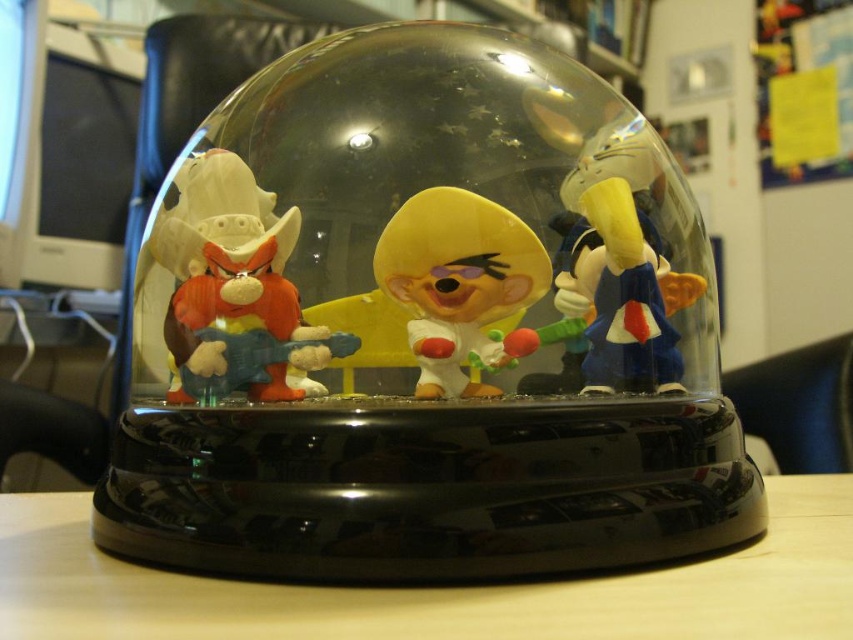
You are holding the glass dome and want to touch the wooden at center and the yellow matte figurine at center. Which one can you reach first without moving your hand?

The wooden at center is closer to the viewer than the yellow matte figurine at center, so you can reach the wooden at center first.

You are a collector who wants to display the two center figurines from the glass dome. Which one is taller, the matte plastic toy at center or the yellow matte figurine at center?

The matte plastic toy at center is taller than the yellow matte figurine at center.

Looking at this image, you are a collector who wants to display the two central figurines from the glass dome. The display shelf has a height limit of 10 cm. Can you place both the matte plastic toy at center and the yellow matte figurine at center on the shelf without exceeding the height limit?

The matte plastic toy at center is bigger than the yellow matte figurine at center, but the exact heights are not provided. Without knowing their specific dimensions, it is impossible to determine if they will fit within the 10 cm height limit.